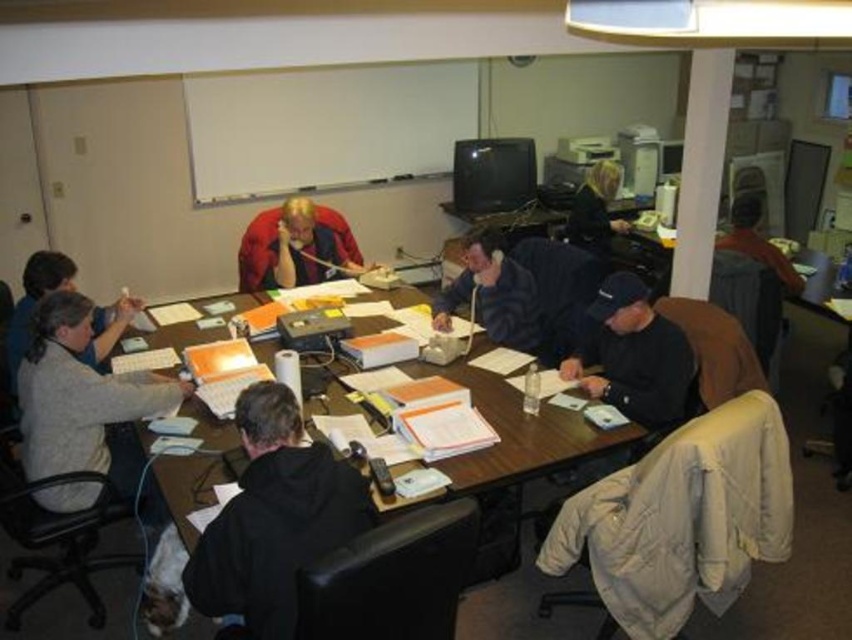
You are a person who wants to place a 18 cm tall coffee mug on the wooden table at center. Can you do that without the mug touching the dark blue shirt at upper right?

The wooden table at center has a lesser height compared to dark blue shirt at upper right, so the coffee mug can be placed on the wooden table at center without touching the dark blue shirt at upper right since the table is shorter than the shirt.

You are a new attendee entering the room and want to sit next to the light gray sweater at left. Which direction should you move relative to the dark blue hoodie at center?

The light gray sweater at left is located below the dark blue hoodie at center, so you should move downward from the dark blue hoodie at center to sit next to the light gray sweater at left.

You are standing in the meeting room and want to move from the point at coordinates (79,449) to the point at coordinates (591,244). Which direction should you move to get closer to your destination?

To move from point (79,449) to point (591,244), you should move upward and to the left since point (79,449) is closer to the viewer than point (591,244), indicating it is positioned lower and further back in the scene.